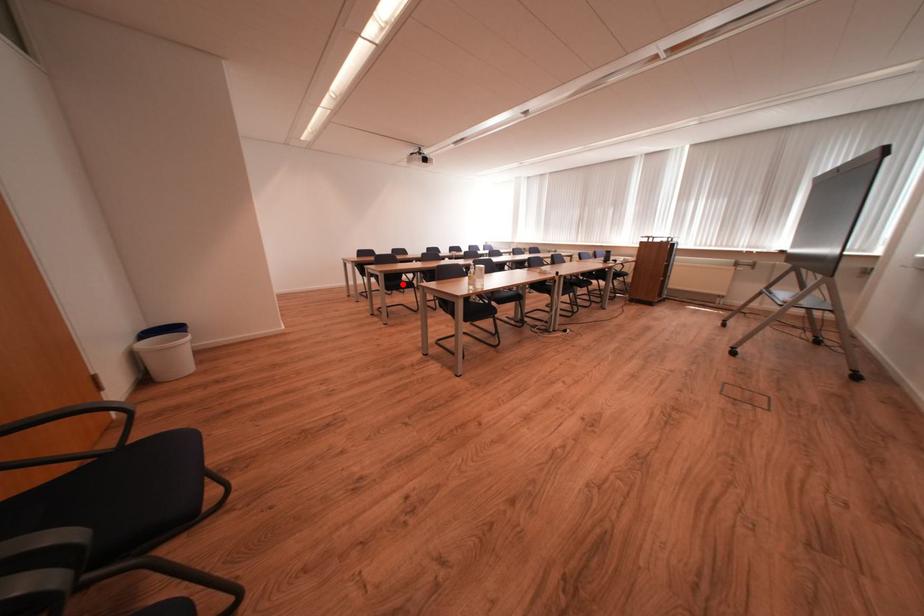
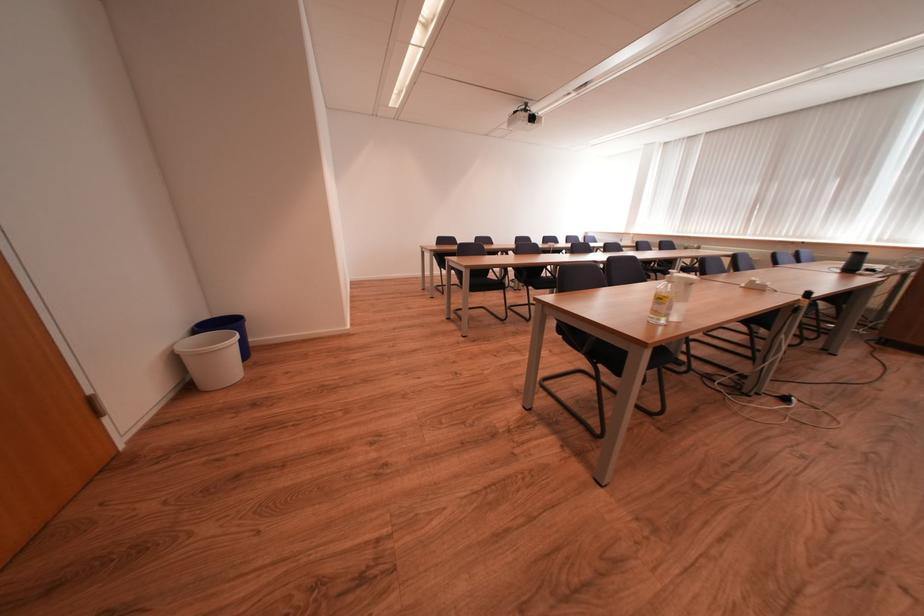
In the second image, find the point that corresponds to the highlighted location in the first image.

(489, 283)